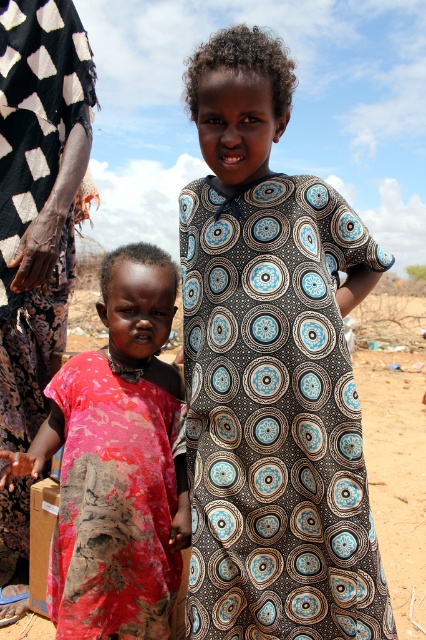
You are a photographer setting up a shoot. You have two dresses in front of you, the black printed dress at center and the rusty fabric dress at center. Which dress takes up more area in the photo?

The rusty fabric dress at center occupies more space than the black printed dress at center, so it takes up more area in the photo.

You are a photographer trying to capture both children in a single frame. Given the distance between the black printed dress at center and the rusty fabric dress at center, will they fit comfortably within the camera frame that has a maximum width of 12 inches?

The distance between the black printed dress at center and the rusty fabric dress at center is 11.15 inches, which is less than the camera frame width of 12 inches. Therefore, both children will fit comfortably within the frame.